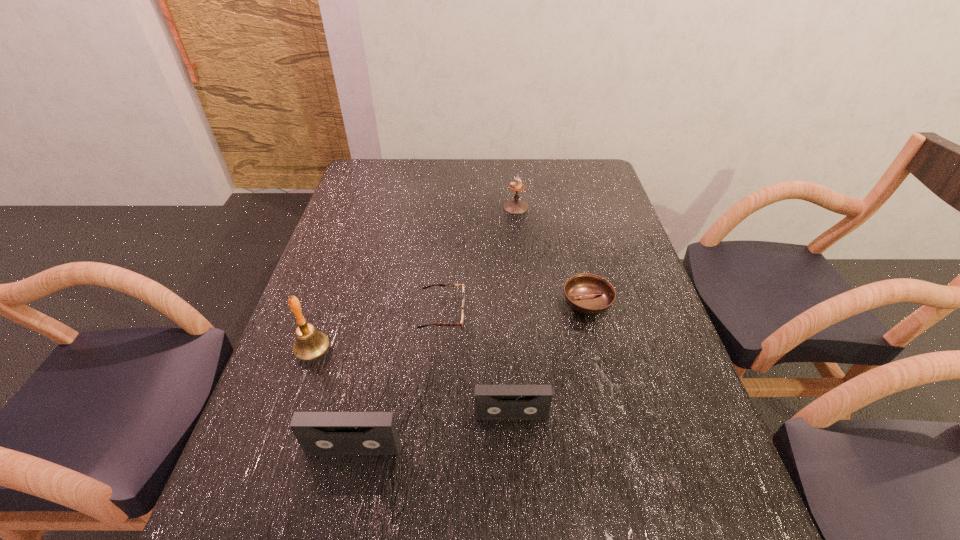
You are a GUI agent. You are given a task and a screenshot of the screen. Output one action in this format:
    pyautogui.click(x=<x>, y=<y>)
    Task: Click on the fifth object from right to left
    
    Given the screenshot: What is the action you would take?
    pyautogui.click(x=319, y=433)

At what (x,y) coordinates should I click in order to perform the action: click on the left videotape. Please return your answer as a coordinate pair (x, y). The width and height of the screenshot is (960, 540). Looking at the image, I should click on tap(319, 433).

Locate an element on the screen. This screenshot has width=960, height=540. the right videotape is located at coordinates (492, 402).

The width and height of the screenshot is (960, 540). I want to click on the farther videotape, so click(x=492, y=402).

The height and width of the screenshot is (540, 960). Identify the location of the fifth shortest object. (514, 206).

Where is `the farthest object`? This screenshot has height=540, width=960. the farthest object is located at coordinates (514, 206).

At what (x,y) coordinates should I click in order to perform the action: click on spectacles. Please return your answer as a coordinate pair (x, y). This screenshot has height=540, width=960. Looking at the image, I should click on pyautogui.click(x=461, y=324).

Identify the location of bell. The image size is (960, 540). (310, 343).

Where is `the third nearest object`? the third nearest object is located at coordinates (310, 343).

Identify the location of the rightmost object. This screenshot has width=960, height=540. (588, 294).